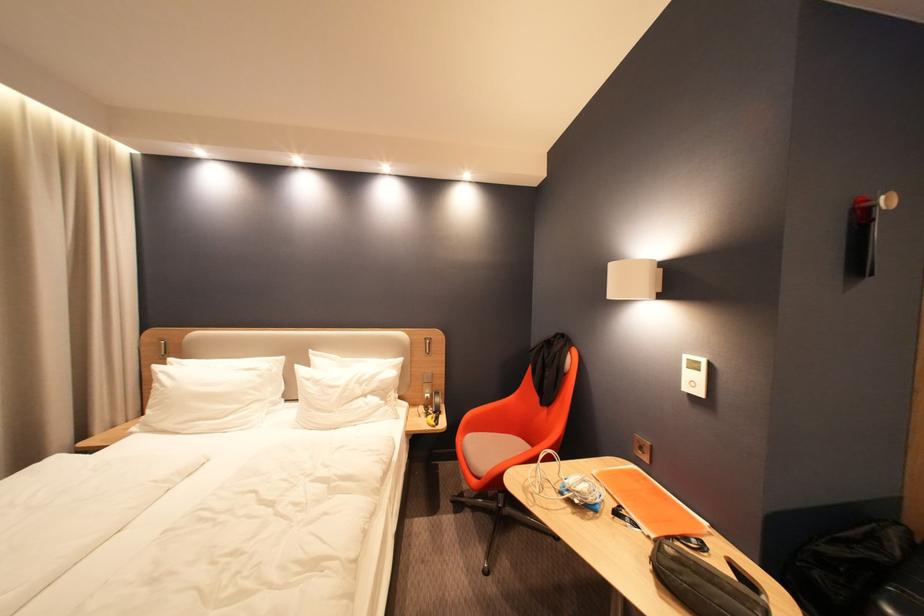
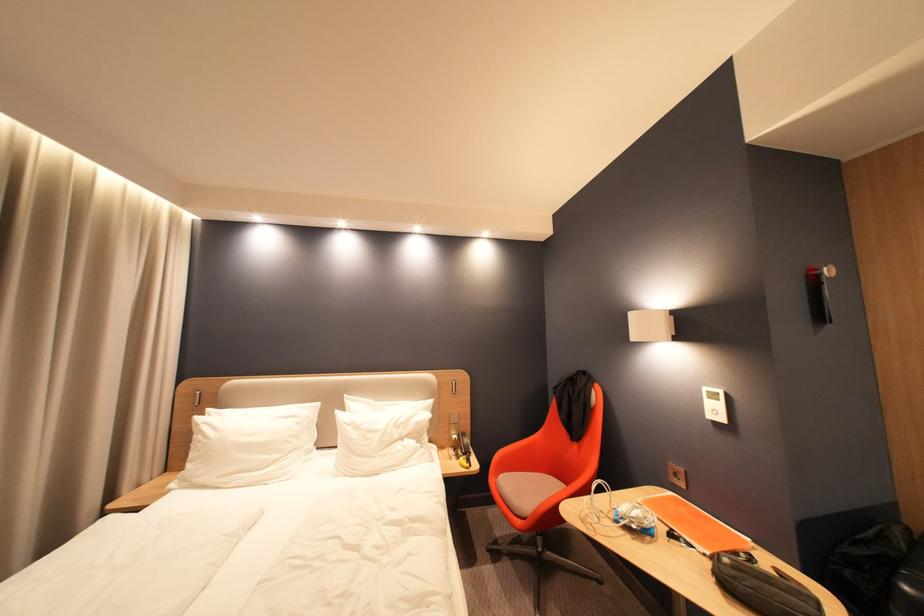
Where in the second image is the point corresponding to point 650,448 from the first image?

(686, 476)